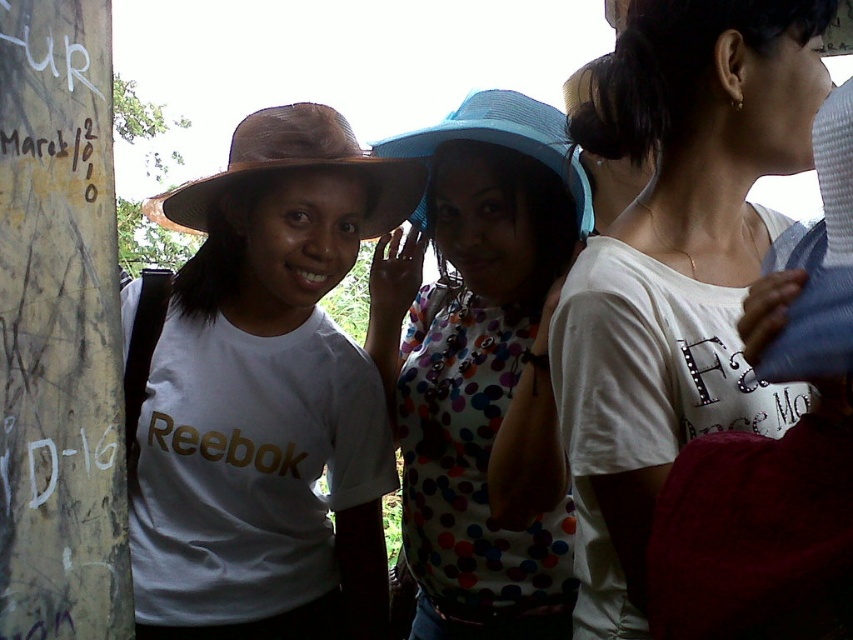
Who is more forward, [376,323] or [251,163]?

Point [251,163]

Which is behind, point (496, 240) or point (157, 216)?

The point (157, 216) is more distant.

This screenshot has width=853, height=640. In order to click on polka dot fabric shirt at center in this screenshot , I will do `click(482, 368)`.

Is matte brown hat at left shorter than polka dot fabric shirt at center?

No, matte brown hat at left is not shorter than polka dot fabric shirt at center.

Is matte brown hat at left closer to camera compared to polka dot fabric shirt at center?

No, matte brown hat at left is behind polka dot fabric shirt at center.

Is point (291, 221) closer to camera compared to point (532, 316)?

Yes, it is in front of point (532, 316).

In order to click on matte brown hat at left in this screenshot , I will do 267,397.

Does white cotton shirt at upper right appear on the left side of polka dot fabric shirt at center?

In fact, white cotton shirt at upper right is to the right of polka dot fabric shirt at center.

Which of these two, white cotton shirt at upper right or polka dot fabric shirt at center, stands taller?

With more height is polka dot fabric shirt at center.

This screenshot has height=640, width=853. What do you see at coordinates (674, 264) in the screenshot?
I see `white cotton shirt at upper right` at bounding box center [674, 264].

At what (x,y) coordinates should I click in order to perform the action: click on white cotton shirt at upper right. Please return your answer as a coordinate pair (x, y). The image size is (853, 640). Looking at the image, I should click on (674, 264).